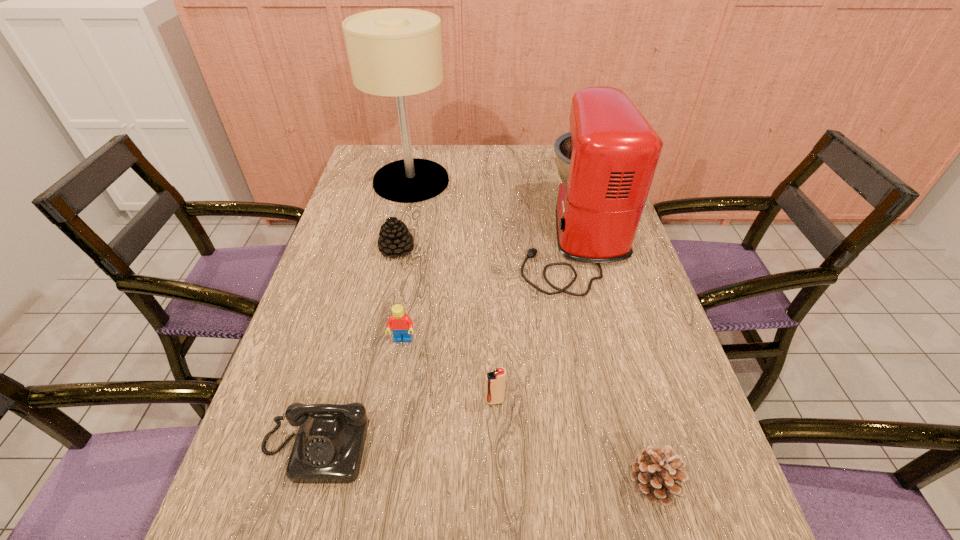
The image size is (960, 540). Find the location of `empty space between the igniter and the kitchen mixer`. empty space between the igniter and the kitchen mixer is located at coordinates (534, 319).

Locate an element on the screen. This screenshot has height=540, width=960. vacant space that is in between the fourth farthest object and the telephone is located at coordinates (359, 394).

Locate an element on the screen. This screenshot has width=960, height=540. vacant region between the left pinecone and the sixth shortest object is located at coordinates (485, 244).

The height and width of the screenshot is (540, 960). Find the location of `free space between the table lamp and the Lego`. free space between the table lamp and the Lego is located at coordinates 407,261.

Identify which object is located as the fifth nearest to the igniter. Please provide its 2D coordinates. Your answer should be formatted as a tuple, i.e. [(x, y)], where the tuple contains the x and y coordinates of a point satisfying the conditions above.

[(395, 240)]

Locate an element on the screen. object that can be found as the third closest to the igniter is located at coordinates (654, 473).

Locate an element on the screen. pinecone that is the closest one to the telephone is located at coordinates (395, 240).

Locate an element on the screen. The height and width of the screenshot is (540, 960). the closest pinecone to the kitchen mixer is located at coordinates (395, 240).

At what (x,y) coordinates should I click in order to perform the action: click on blank space that satisfies the following two spatial constraints: 1. on the face of the right pinecone; 2. on the left side of the Lego. Please return your answer as a coordinate pair (x, y). Image resolution: width=960 pixels, height=540 pixels. Looking at the image, I should click on (380, 484).

Locate an element on the screen. The width and height of the screenshot is (960, 540). vacant region that satisfies the following two spatial constraints: 1. on the front-facing side of the kitchen mixer; 2. on the back side of the nearer pinecone is located at coordinates (631, 484).